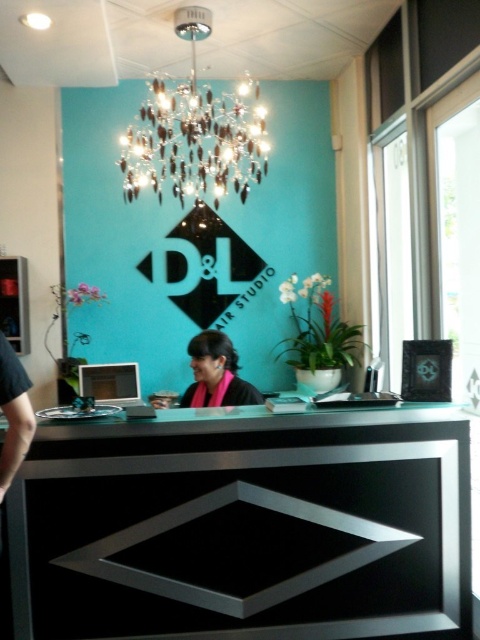
Can you confirm if black glossy table at center is bigger than crystal glass chandelier at upper center?

No, black glossy table at center is not bigger than crystal glass chandelier at upper center.

Between point (118, 586) and point (172, 140), which one is positioned in front?

Point (118, 586)

From the picture: Measure the distance between point (424, 630) and camera.

They are 7.95 feet apart.

Identify the location of black glossy table at center. This screenshot has height=640, width=480. (244, 525).

Is point (344, 512) positioned in front of point (216, 378)?

Yes, point (344, 512) is in front of point (216, 378).

Which is in front, point (330, 573) or point (203, 396)?

Positioned in front is point (330, 573).

Is point (348, 548) closer to viewer compared to point (239, 401)?

That is True.

In order to click on black glossy table at center in this screenshot , I will do `click(244, 525)`.

Can you confirm if crystal glass chandelier at upper center is positioned below pink fabric scarf at center?

No.

Between crystal glass chandelier at upper center and pink fabric scarf at center, which one has more height?

With more height is crystal glass chandelier at upper center.

Which is in front, point (197, 122) or point (191, 390)?

Point (197, 122) is in front.

Identify the location of crystal glass chandelier at upper center. The width and height of the screenshot is (480, 640). (195, 131).